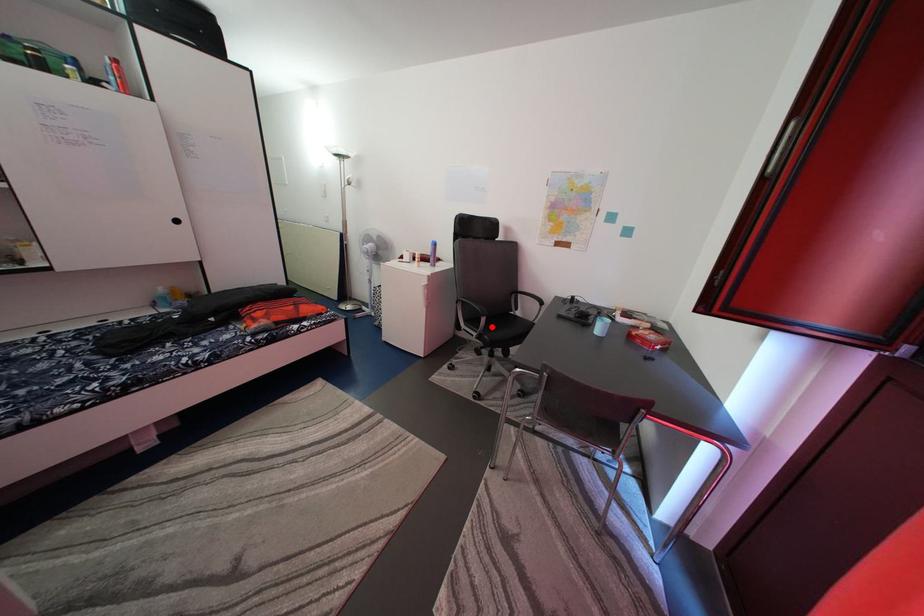
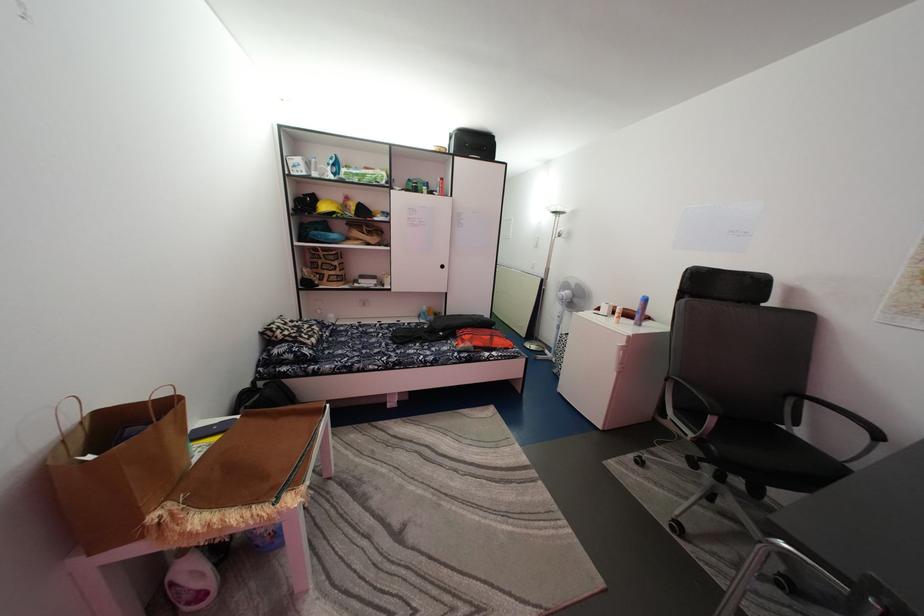
Where in the second image is the point corresponding to the highlighted location from the first image?

(721, 427)